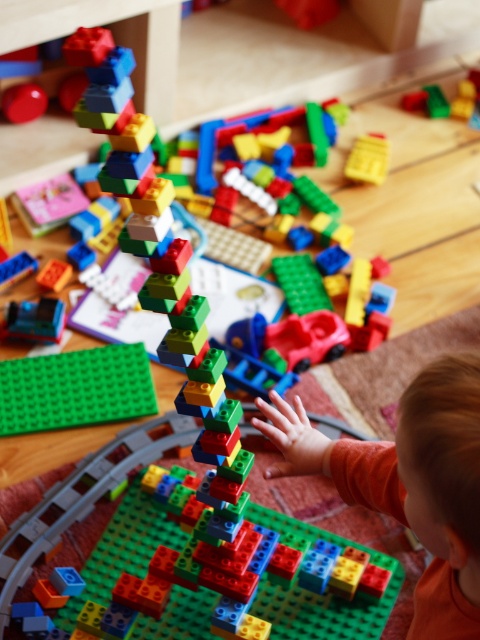
Question: Which of the following is the closest to the observer?

Choices:
 (A) (447, 532)
 (B) (56, 388)

Answer: (A)

Question: Is orange soft baby at center positioned in front of green matte baseplate at center?

Choices:
 (A) yes
 (B) no

Answer: (A)

Question: Which point is closer to the camera?

Choices:
 (A) (437, 400)
 (B) (45, 372)

Answer: (A)

Question: Which point appears closest to the camera in this image?

Choices:
 (A) (132, 388)
 (B) (267, 436)

Answer: (B)

Question: Can you confirm if orange soft baby at center is positioned to the left of green matte baseplate at center?

Choices:
 (A) yes
 (B) no

Answer: (B)

Question: Does orange soft baby at center appear over green matte baseplate at center?

Choices:
 (A) yes
 (B) no

Answer: (B)